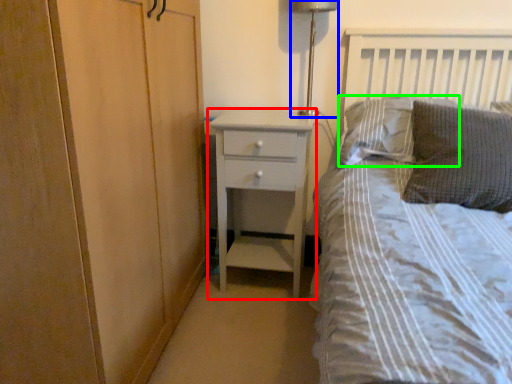
Question: Which object is the closest to the chest of drawers (highlighted by a red box)? Choose among these: bedside lamp (highlighted by a blue box) or pillow (highlighted by a green box).

Choices:
 (A) bedside lamp
 (B) pillow

Answer: (B)